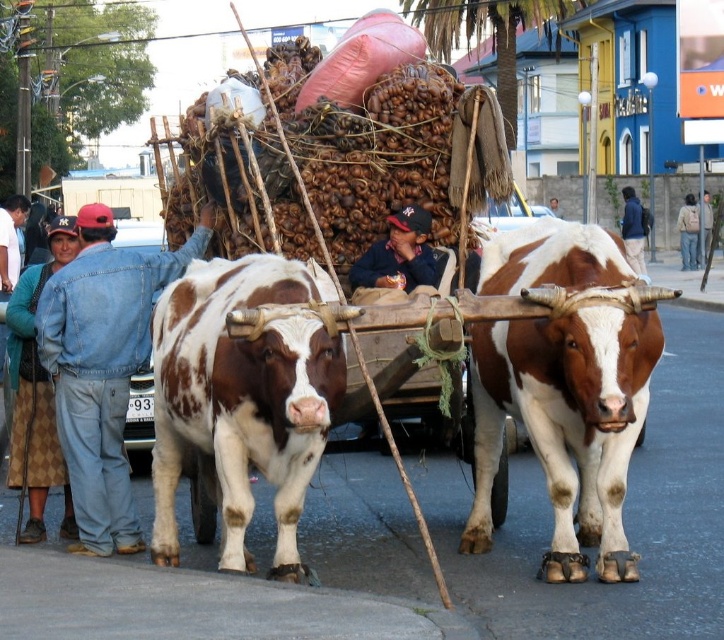
Is brown and white textured bull at center positioned in front of brown spotted hide at center?

No.

Image resolution: width=724 pixels, height=640 pixels. What do you see at coordinates (564, 387) in the screenshot?
I see `brown and white textured bull at center` at bounding box center [564, 387].

Does point (605, 428) come closer to viewer compared to point (181, 422)?

Yes, it is.

Locate an element on the screen. This screenshot has width=724, height=640. brown and white textured bull at center is located at coordinates (564, 387).

Does denim jacket at left appear over blue denim jacket at center?

Actually, denim jacket at left is below blue denim jacket at center.

Is point (105, 408) less distant than point (387, 250)?

Yes.

Locate an element on the screen. This screenshot has height=640, width=724. denim jacket at left is located at coordinates (104, 365).

Is brown and white textured bull at center below blue denim jacket at center?

Indeed, brown and white textured bull at center is positioned under blue denim jacket at center.

Does brown and white textured bull at center come behind blue denim jacket at center?

No, brown and white textured bull at center is in front of blue denim jacket at center.

This screenshot has width=724, height=640. What are the coordinates of `brown and white textured bull at center` in the screenshot? It's located at (564, 387).